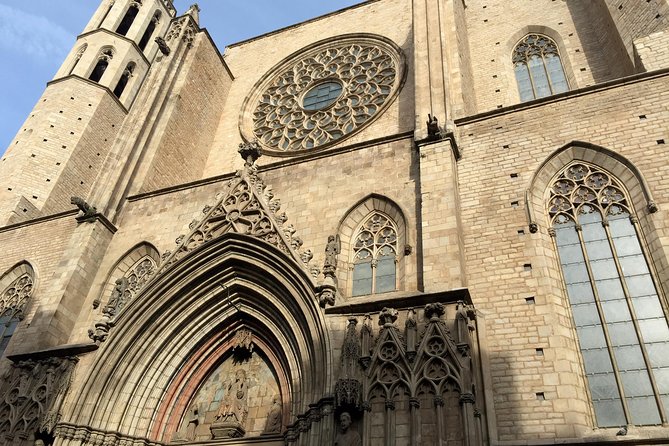
This screenshot has width=669, height=446. Find the location of `the first arched window 3rd floor`. the first arched window 3rd floor is located at coordinates (533, 51).